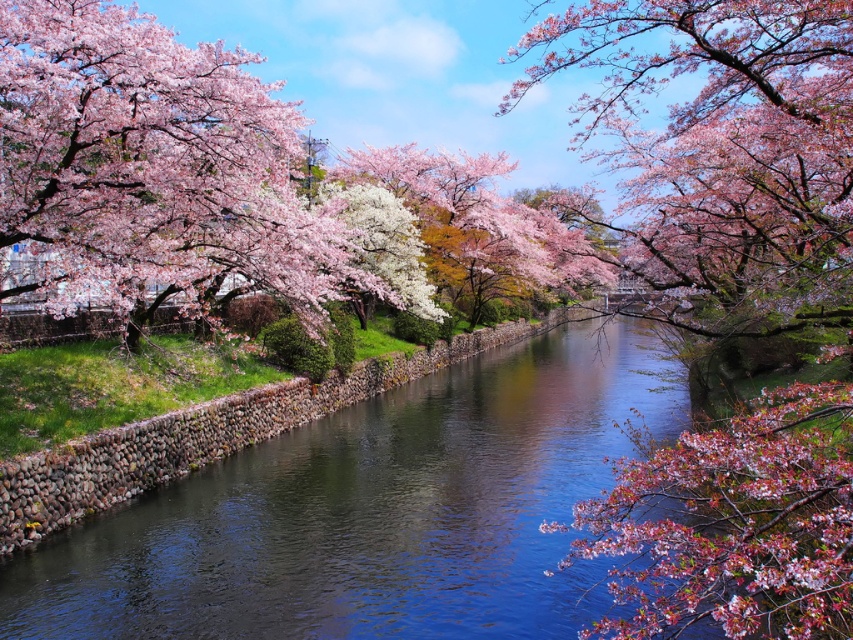
You are a boat captain navigating a small boat through the canal. You notice the pink blossoms at center and the clear water at center. Which object is positioned to the right of the other?

The pink blossoms at center is to the right of clear water at center.

You are an artist planning to paint the canal scene. You want to emphasize the pink blossoms at center and clear water at center in your painting. Based on their widths, which object should you allocate more space to in your composition?

The pink blossoms at center should be allocated more space in the composition since their width surpasses that of the clear water at center, as stated in the description.